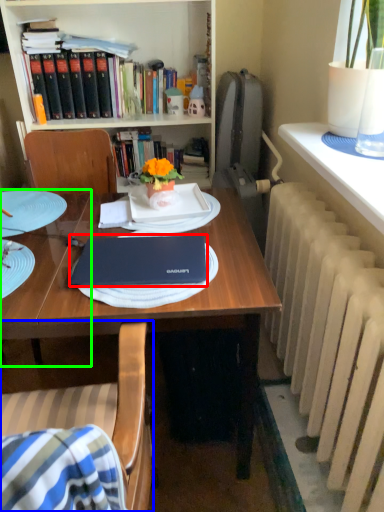
Question: Estimate the real-world distances between objects in this image. Which object is farther from laptop (highlighted by a red box), chair (highlighted by a blue box) or table (highlighted by a green box)?

Choices:
 (A) chair
 (B) table

Answer: (B)